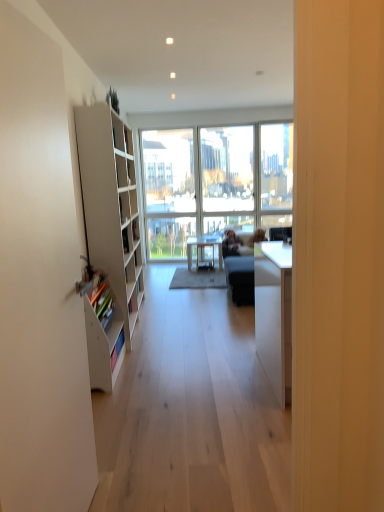
Image resolution: width=384 pixels, height=512 pixels. Find the location of `vacant space to the right of white matte bookshelf at left`. vacant space to the right of white matte bookshelf at left is located at coordinates (152, 373).